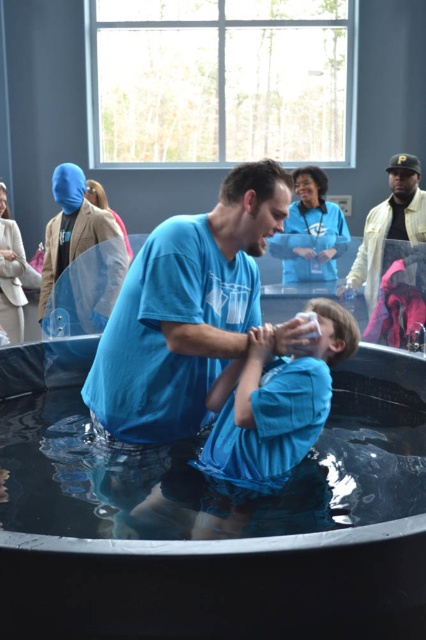
You are a photographer at the baptism ceremony. You need to position yourself so that the blue matte mask at upper left and the yellow leather jacket at upper right are both visible in your frame. Based on their positions, which object should you place higher in your camera viewfinder to ensure both are in the shot?

The yellow leather jacket at upper right should be placed higher in the camera viewfinder because the blue matte mask at upper left is below it, so positioning the jacket higher will allow both objects to be captured within the frame.

You are a photographer standing at the camera position. You want to capture a closeup shot of the matte blue shirt at center without moving the camera. Is it possible to zoom in enough to get a clear closeup?

The matte blue shirt at center is 1.68 meters away from camera, so yes, a photographer can zoom in enough to get a clear closeup without moving the camera since the distance is manageable for a zoom lens.